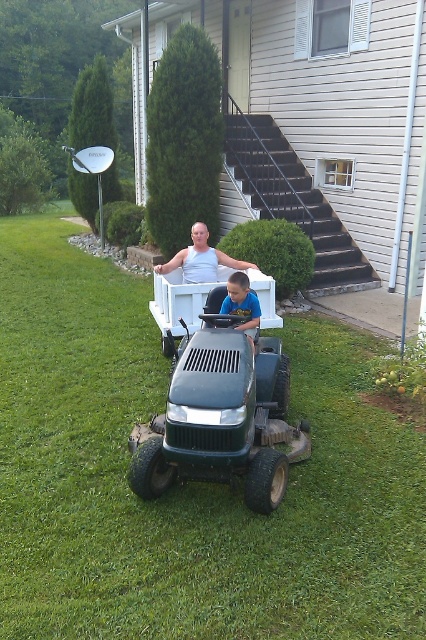
You are a gardener who needs to mow the lawn. The green grass at center is currently taller than the white tank top at center. Which object should you prioritize mowing first according to standard lawn maintenance practices?

The green grass at center should be prioritized for mowing first because it is taller than the white tank top at center, indicating it requires immediate attention to maintain a uniform height.

You are standing in the residential house yard and see the green grass at center and the white tank top at center. Which object is located to the left side from your perspective?

The green grass at center is located to the left of the white tank top at center.

You are a delivery person trying to place a package on the white plastic wagon at center. You notice there is a white tank top at center nearby. How far apart are these two items?

The white plastic wagon at center and white tank top at center are 14.25 inches apart.